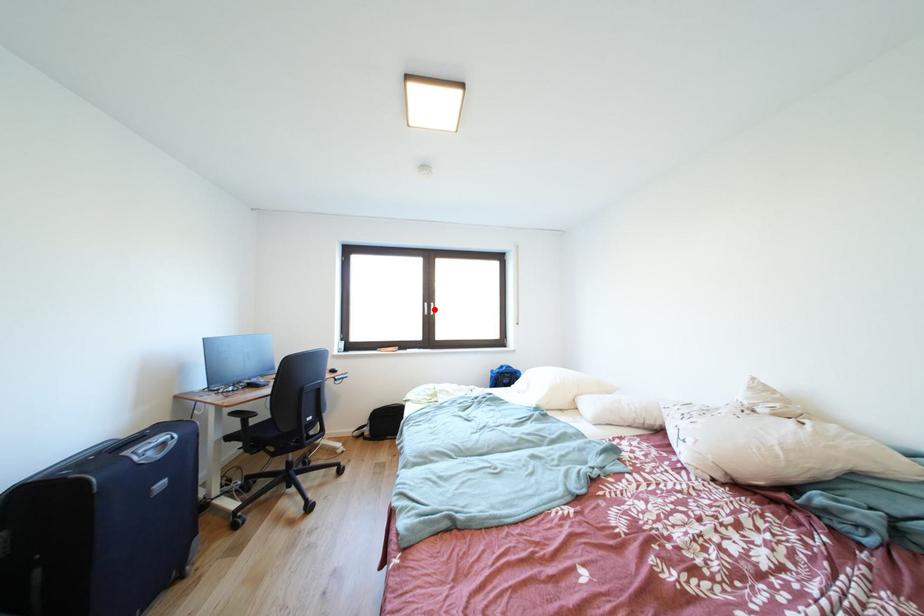
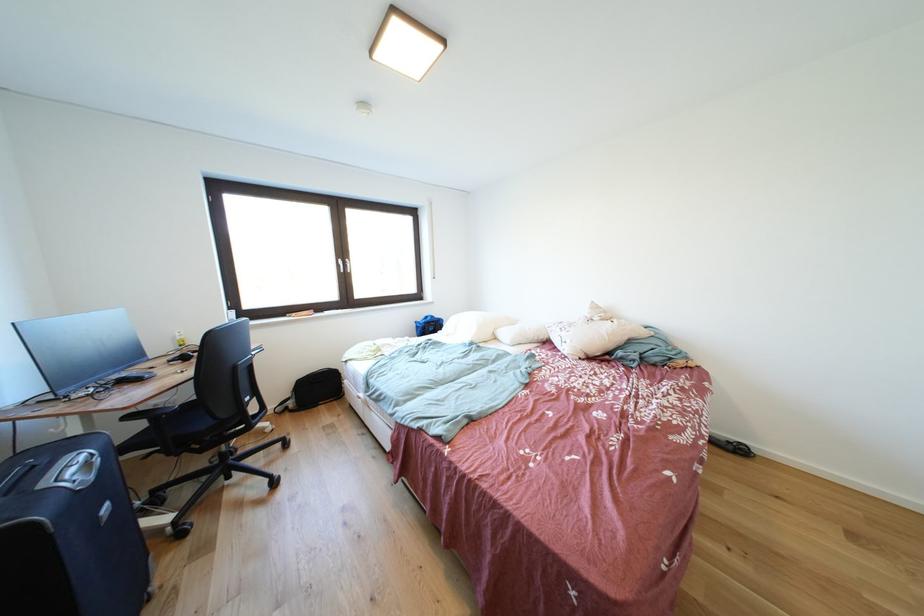
Question: I am providing you with two images of the same scene from different viewpoints. A red point is shown in image1. For the corresponding object point in image2, is it positioned nearer or farther from the camera?

Choices:
 (A) Nearer
 (B) Farther

Answer: (A)